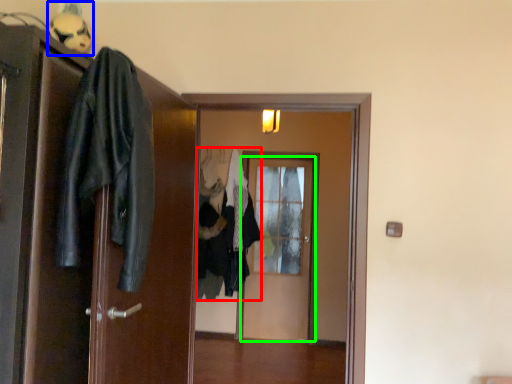
Question: Considering the real-world distances, which object is farthest from clothing (highlighted by a red box)? figurine (highlighted by a blue box) or door (highlighted by a green box)?

Choices:
 (A) figurine
 (B) door

Answer: (A)